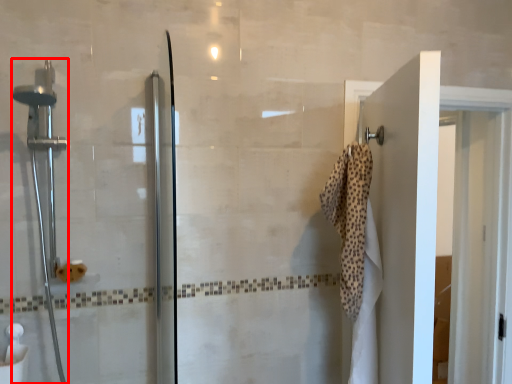
Question: From the image's perspective, considering the relative positions of shower (annotated by the red box) and bath towel in the image provided, where is shower (annotated by the red box) located with respect to the staircase?

Choices:
 (A) below
 (B) above

Answer: (B)